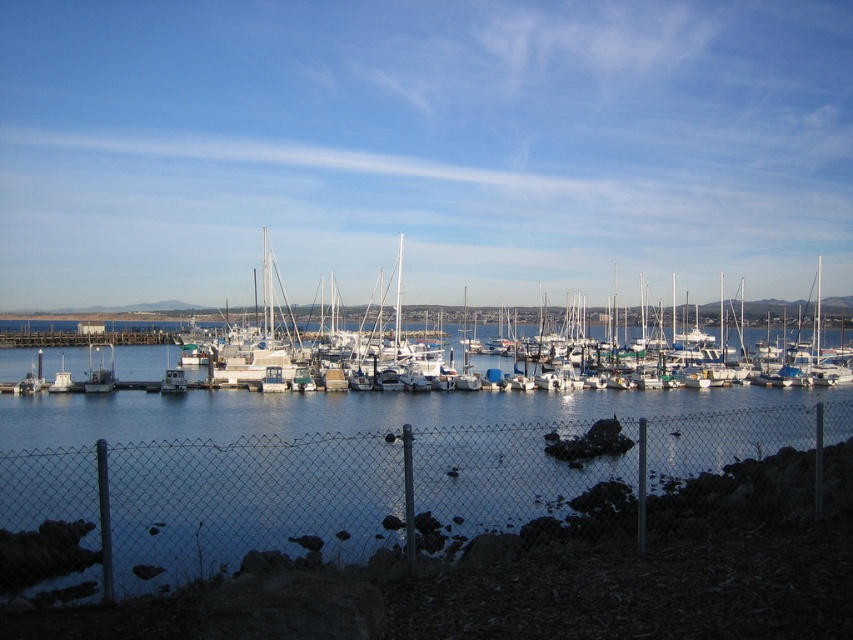
Question: Is metallic gray boat at left thinner than white matte boat at left?

Choices:
 (A) yes
 (B) no

Answer: (B)

Question: Considering the real-world distances, which object is closest to the white matte boat at left?

Choices:
 (A) metallic gray boat at left
 (B) white matte boats at center

Answer: (A)

Question: Which object is farther from the camera taking this photo?

Choices:
 (A) white matte boat at left
 (B) metallic gray boat at left

Answer: (A)

Question: Does metal chain-link fence at lower center have a lesser width compared to white matte boat at left?

Choices:
 (A) yes
 (B) no

Answer: (A)

Question: Is metal chain-link fence at lower center to the left of white matte boats at center from the viewer's perspective?

Choices:
 (A) yes
 (B) no

Answer: (A)

Question: Among these objects, which one is farthest from the camera?

Choices:
 (A) metallic gray boat at left
 (B) white matte boats at center

Answer: (B)